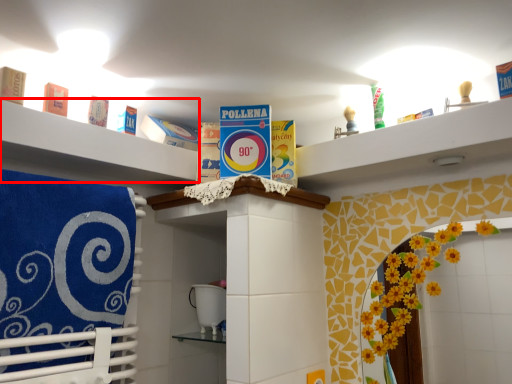
Question: Considering the relative positions of shelf (annotated by the red box) and beach towel in the image provided, where is shelf (annotated by the red box) located with respect to the staircase?

Choices:
 (A) left
 (B) right

Answer: (B)